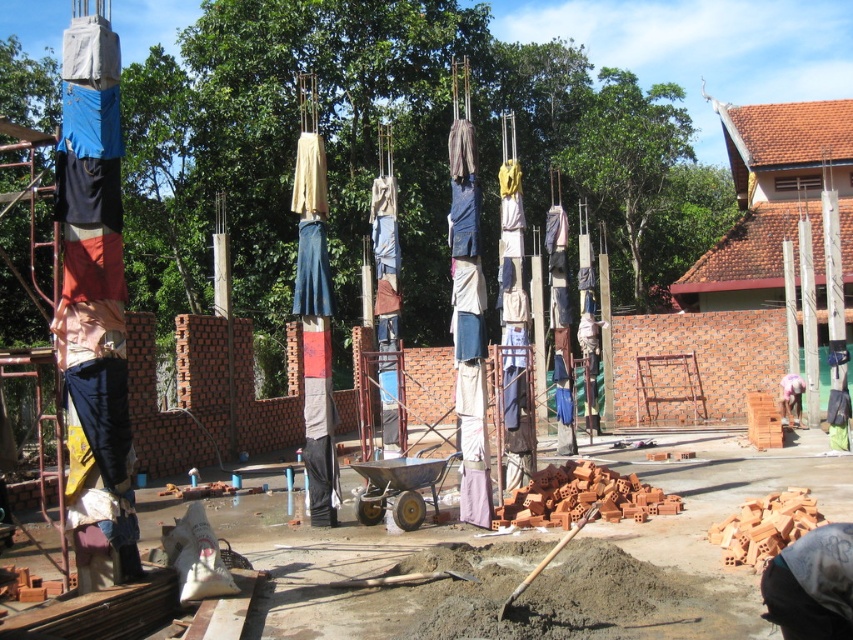
Is light brown fabric at center wider than light pink fabric at center?

No.

Where is `light brown fabric at center`? Image resolution: width=853 pixels, height=640 pixels. light brown fabric at center is located at coordinates (589, 360).

Find the location of a particular element. light brown fabric at center is located at coordinates (589, 360).